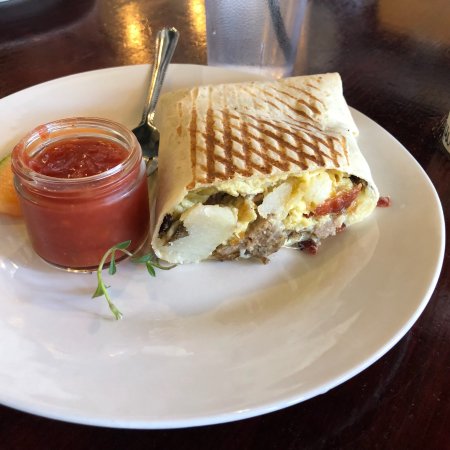
The height and width of the screenshot is (450, 450). I want to click on plate, so click(234, 302).